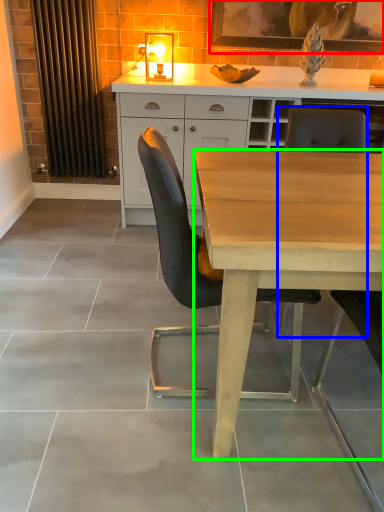
Question: Considering the real-world distances, which object is farthest from picture frame (highlighted by a red box)? chair (highlighted by a blue box) or desk (highlighted by a green box)?

Choices:
 (A) chair
 (B) desk

Answer: (B)